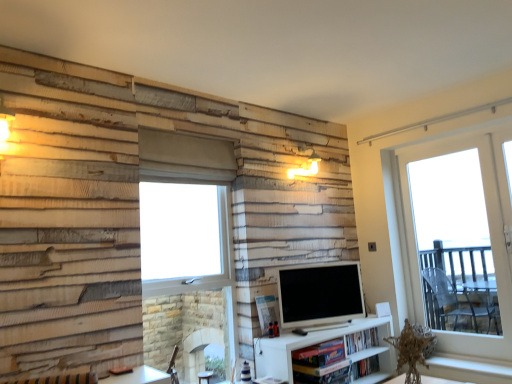
The width and height of the screenshot is (512, 384). What do you see at coordinates (362, 340) in the screenshot?
I see `hardcover book at center` at bounding box center [362, 340].

Image resolution: width=512 pixels, height=384 pixels. What do you see at coordinates (489, 235) in the screenshot?
I see `transparent glass door at right, placed as the second window when sorted from left to right` at bounding box center [489, 235].

Identify the location of matte white tv at center. The width and height of the screenshot is (512, 384). coord(320,294).

Based on the photo, from a real-world perspective, which object stands above the other?

From a 3D spatial view, transparent glass door at right, marked as the first window in a right-to-left arrangement, is above.

Find the location of a particular element. window on the right of white wood window sill at lower right is located at coordinates (489, 235).

Is white wood window sill at lower right completely or partially outside of transparent glass door at right, placed as the second window when sorted from left to right?

Yes.

Is white wood window sill at lower right next to transparent glass door at right, placed as the second window when sorted from left to right, and touching it?

No, white wood window sill at lower right is not making contact with transparent glass door at right, placed as the second window when sorted from left to right.

Relative to matte white tv at center, is transparent glass door at right, placed as the second window when sorted from left to right, in front or behind?

In the image, transparent glass door at right, placed as the second window when sorted from left to right, appears behind matte white tv at center.

Considering the points (456, 335) and (312, 312), which point is in front, point (456, 335) or point (312, 312)?

The point (312, 312) is in front.

Is transparent glass door at right, marked as the first window in a right-to-left arrangement, inside or outside of matte white tv at center?

transparent glass door at right, marked as the first window in a right-to-left arrangement, lies outside matte white tv at center.

Who is more distant, hardcover book at center or white wood window sill at lower right?

Positioned behind is hardcover book at center.

Locate an element on the screen. This screenshot has width=512, height=384. window sill on the right of hardcover book at center is located at coordinates (468, 368).

Measure the distance from hardcover book at center to white wood window sill at lower right.

They are 27.21 inches apart.

Which is more to the right, hardcover book at center or white wood window sill at lower right?

Positioned to the right is white wood window sill at lower right.

Can you confirm if white wood window sill at lower right is positioned to the left of matte white tv at center?

No, white wood window sill at lower right is not to the left of matte white tv at center.

From the picture: Could you tell me if white wood window sill at lower right is turned towards matte white tv at center?

No, white wood window sill at lower right is not turned towards matte white tv at center.

Considering the relative sizes of white wood window sill at lower right and matte white tv at center in the image provided, is white wood window sill at lower right wider than matte white tv at center?

Correct, the width of white wood window sill at lower right exceeds that of matte white tv at center.

Is there a large distance between white wood window sill at lower right and matte white tv at center?

Yes, white wood window sill at lower right and matte white tv at center are quite far apart.

Between point (348, 340) and point (231, 250), which one is positioned behind?

The point (348, 340) is farther.

From a real-world perspective, which is physically below, hardcover book at center or clear glass window at center, which appears as the first window when viewed from the left?

In real-world perspective, hardcover book at center is lower.

Where is `book on the right of clear glass window at center, placed as the 2th window when sorted from right to left`? The height and width of the screenshot is (384, 512). book on the right of clear glass window at center, placed as the 2th window when sorted from right to left is located at coordinates (362, 340).

Find the location of a particular element. window below the transparent glass door at right, placed as the second window when sorted from left to right (from a real-world perspective) is located at coordinates (187, 248).

Are transparent glass door at right, placed as the second window when sorted from left to right, and clear glass window at center, placed as the 2th window when sorted from right to left, making contact?

There is a gap between transparent glass door at right, placed as the second window when sorted from left to right, and clear glass window at center, placed as the 2th window when sorted from right to left.

Which of these two, transparent glass door at right, marked as the first window in a right-to-left arrangement, or clear glass window at center, placed as the 2th window when sorted from right to left, is bigger?

Bigger between the two is clear glass window at center, placed as the 2th window when sorted from right to left.

From a real-world perspective, who is located higher, transparent glass door at right, placed as the second window when sorted from left to right, or clear glass window at center, which appears as the first window when viewed from the left?

transparent glass door at right, placed as the second window when sorted from left to right, from a real-world perspective.

In terms of height, does white wood window sill at lower right look taller or shorter compared to clear glass window at center, which appears as the first window when viewed from the left?

Clearly, white wood window sill at lower right is shorter compared to clear glass window at center, which appears as the first window when viewed from the left.

Can you confirm if white wood window sill at lower right is wider than clear glass window at center, placed as the 2th window when sorted from right to left?

Yes.

Locate an element on the screen. This screenshot has height=384, width=512. the 1st window positioned above the white wood window sill at lower right (from the image's perspective) is located at coordinates (187, 248).

Identify the location of window behind the white wood window sill at lower right. pos(489,235).

This screenshot has height=384, width=512. In order to click on window that is the 2nd object above the matte white tv at center (from a real-world perspective) in this screenshot , I will do `click(489, 235)`.

From the image, which object appears to be farther from hardcover book at center, matte white tv at center or transparent glass door at right, marked as the first window in a right-to-left arrangement?

transparent glass door at right, marked as the first window in a right-to-left arrangement, lies further to hardcover book at center than the other object.

Looking at the image, which one is located further to clear glass window at center, placed as the 2th window when sorted from right to left, matte white tv at center or transparent glass door at right, placed as the second window when sorted from left to right?

transparent glass door at right, placed as the second window when sorted from left to right, is further to clear glass window at center, placed as the 2th window when sorted from right to left.

Considering their positions, is clear glass window at center, placed as the 2th window when sorted from right to left, positioned further to white wood window sill at lower right than transparent glass door at right, placed as the second window when sorted from left to right?

clear glass window at center, placed as the 2th window when sorted from right to left.

Considering their positions, is clear glass window at center, placed as the 2th window when sorted from right to left, positioned further to white wood window sill at lower right than hardcover book at center?

clear glass window at center, placed as the 2th window when sorted from right to left, is positioned further to the anchor white wood window sill at lower right.

Estimate the real-world distances between objects in this image. Which object is further from white wood window sill at lower right, transparent glass door at right, marked as the first window in a right-to-left arrangement, or clear glass window at center, which appears as the first window when viewed from the left?

clear glass window at center, which appears as the first window when viewed from the left.

Based on their spatial positions, is transparent glass door at right, marked as the first window in a right-to-left arrangement, or clear glass window at center, placed as the 2th window when sorted from right to left, closer to matte white tv at center?

The object closer to matte white tv at center is clear glass window at center, placed as the 2th window when sorted from right to left.

Which object lies nearer to the anchor point hardcover book at center, white wood window sill at lower right or transparent glass door at right, marked as the first window in a right-to-left arrangement?

Among the two, white wood window sill at lower right is located nearer to hardcover book at center.

When comparing their distances from hardcover book at center, does matte white tv at center or clear glass window at center, placed as the 2th window when sorted from right to left, seem closer?

matte white tv at center is closer to hardcover book at center.

Locate an element on the screen. The width and height of the screenshot is (512, 384). window sill situated between matte white tv at center and transparent glass door at right, marked as the first window in a right-to-left arrangement, from left to right is located at coordinates (468, 368).

I want to click on television between clear glass window at center, which appears as the first window when viewed from the left, and transparent glass door at right, marked as the first window in a right-to-left arrangement, from left to right, so click(x=320, y=294).

At what (x,y) coordinates should I click in order to perform the action: click on book situated between matte white tv at center and white wood window sill at lower right from left to right. Please return your answer as a coordinate pair (x, y). This screenshot has width=512, height=384. Looking at the image, I should click on (362, 340).

Locate an element on the screen. television between clear glass window at center, which appears as the first window when viewed from the left, and white wood window sill at lower right is located at coordinates (320, 294).